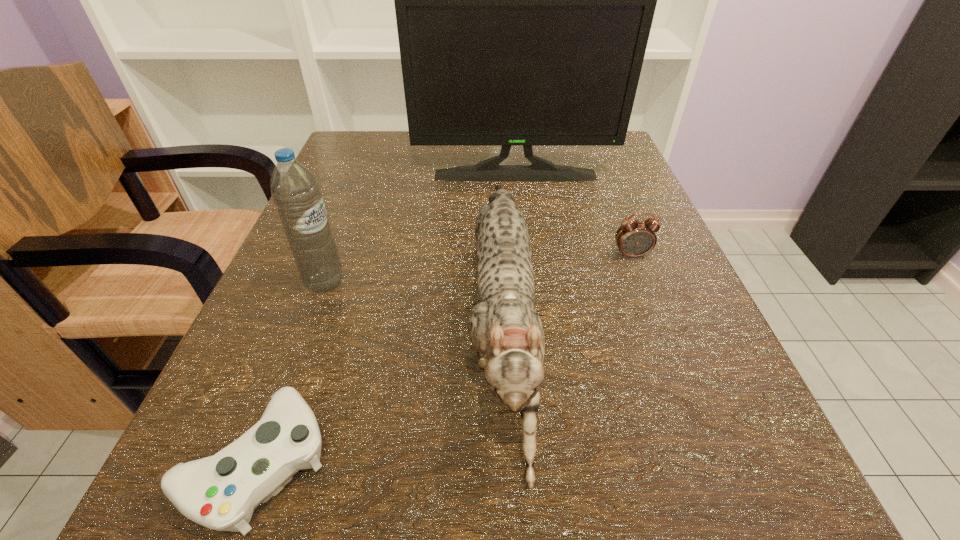
Locate an element on the screen. This screenshot has height=540, width=960. monitor is located at coordinates (524, 0).

This screenshot has width=960, height=540. Find the location of `the tallest object`. the tallest object is located at coordinates (524, 0).

The height and width of the screenshot is (540, 960). Identify the location of water bottle. (294, 188).

Locate an element on the screen. cat is located at coordinates [x=504, y=327].

The image size is (960, 540). I want to click on alarm clock, so click(x=635, y=238).

Identify the location of free region located 0.280m on the front-facing side of the monitor. The width and height of the screenshot is (960, 540). (526, 274).

Identify the location of vacant space located 0.160m on the right of the water bottle. The width and height of the screenshot is (960, 540). [x=447, y=282].

Identify the location of vacant space situated on the face of the fourth tallest object. (691, 409).

Locate an element on the screen. The width and height of the screenshot is (960, 540). object that is at the far edge is located at coordinates (524, 0).

This screenshot has width=960, height=540. What are the coordinates of `object that is at the near edge` in the screenshot? It's located at (504, 327).